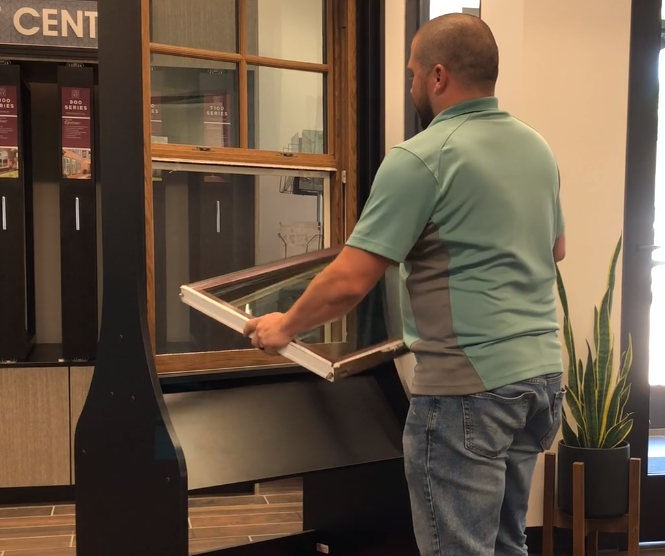
Where is `cabinet`? cabinet is located at coordinates (42, 406), (80, 376).